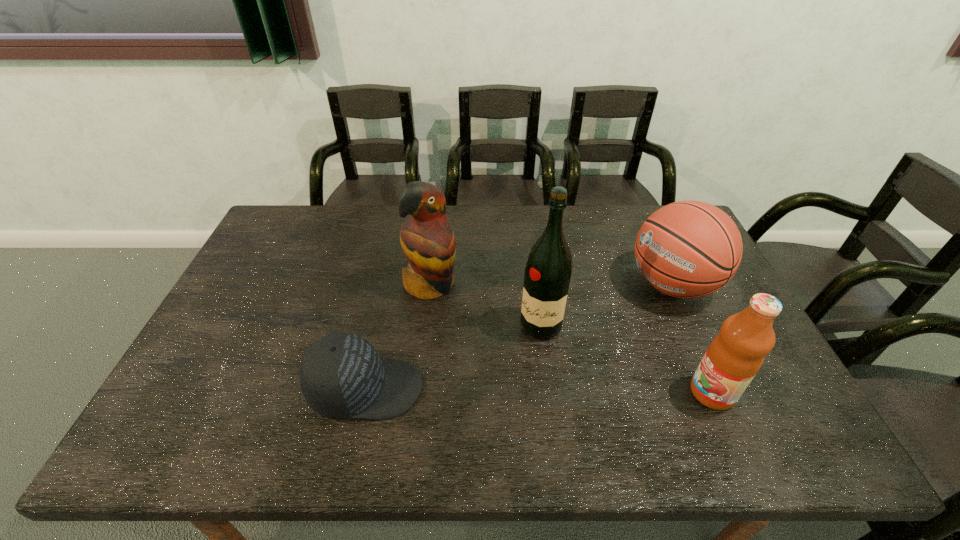
The image size is (960, 540). In order to click on vacant space on the desktop that is between the shortest object and the fruit juice and is positioned on the front-facing side of the liquor in this screenshot , I will do `click(495, 390)`.

Where is `free space on the desktop that is between the baseball cap and the fruit juice and is positioned on the logo side of the basketball`? free space on the desktop that is between the baseball cap and the fruit juice and is positioned on the logo side of the basketball is located at coordinates (490, 390).

Where is `vacant space on the desktop that is between the shortest object and the fruit juice and is positioned on the face of the parrot`? This screenshot has width=960, height=540. vacant space on the desktop that is between the shortest object and the fruit juice and is positioned on the face of the parrot is located at coordinates (521, 390).